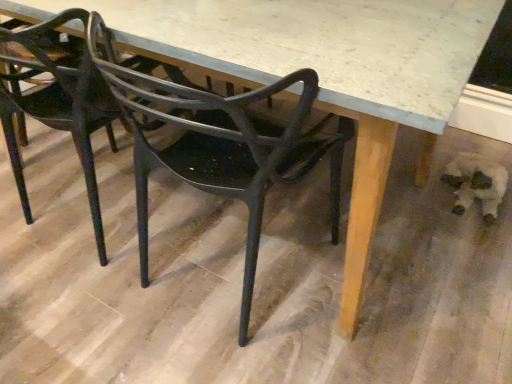
Question: Is matte black chair at center, placed as the second chair when sorted from right to left, inside matte black chair at center, the second chair positioned from the left?

Choices:
 (A) no
 (B) yes

Answer: (A)

Question: From the image's perspective, would you say matte black chair at center, the second chair positioned from the left, is positioned over matte black chair at center, placed as the second chair when sorted from right to left?

Choices:
 (A) no
 (B) yes

Answer: (A)

Question: Is the depth of matte black chair at center, marked as the first chair in a right-to-left arrangement, greater than that of matte black chair at center, placed as the second chair when sorted from right to left?

Choices:
 (A) no
 (B) yes

Answer: (A)

Question: Is matte black chair at center, marked as the first chair in a right-to-left arrangement, positioned before matte black chair at center, the 1th chair in the left-to-right sequence?

Choices:
 (A) yes
 (B) no

Answer: (A)

Question: Is matte black chair at center, the second chair positioned from the left, oriented away from matte black chair at center, the 1th chair in the left-to-right sequence?

Choices:
 (A) no
 (B) yes

Answer: (A)

Question: Considering the relative sizes of matte black chair at center, marked as the first chair in a right-to-left arrangement, and matte black chair at center, placed as the second chair when sorted from right to left, in the image provided, is matte black chair at center, marked as the first chair in a right-to-left arrangement, bigger than matte black chair at center, placed as the second chair when sorted from right to left,?

Choices:
 (A) no
 (B) yes

Answer: (A)

Question: Is matte black chair at center, the second chair positioned from the left, positioned with its back to fuzzy white dog at lower right?

Choices:
 (A) yes
 (B) no

Answer: (B)

Question: Can you confirm if matte black chair at center, marked as the first chair in a right-to-left arrangement, is positioned to the right of fuzzy white dog at lower right?

Choices:
 (A) yes
 (B) no

Answer: (B)

Question: Does matte black chair at center, marked as the first chair in a right-to-left arrangement, have a smaller size compared to fuzzy white dog at lower right?

Choices:
 (A) yes
 (B) no

Answer: (B)

Question: From the image's perspective, is matte black chair at center, marked as the first chair in a right-to-left arrangement, beneath fuzzy white dog at lower right?

Choices:
 (A) no
 (B) yes

Answer: (B)

Question: Is matte black chair at center, the second chair positioned from the left, bigger than fuzzy white dog at lower right?

Choices:
 (A) no
 (B) yes

Answer: (B)

Question: From a real-world perspective, is matte black chair at center, marked as the first chair in a right-to-left arrangement, over fuzzy white dog at lower right?

Choices:
 (A) yes
 (B) no

Answer: (A)

Question: Is fuzzy white dog at lower right further to the viewer compared to matte black chair at center, the 1th chair in the left-to-right sequence?

Choices:
 (A) yes
 (B) no

Answer: (A)